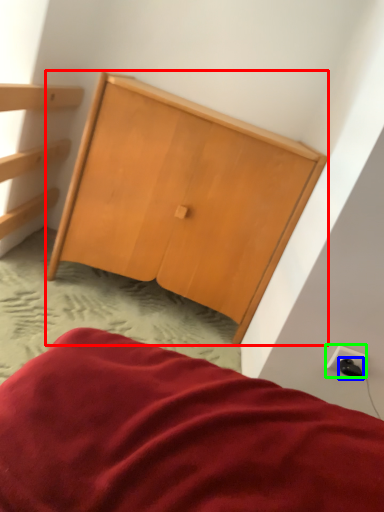
Question: Which object is the farthest from furniture (highlighted by a red box)? Choose among these: plug (highlighted by a blue box) or electric outlet (highlighted by a green box).

Choices:
 (A) plug
 (B) electric outlet

Answer: (A)